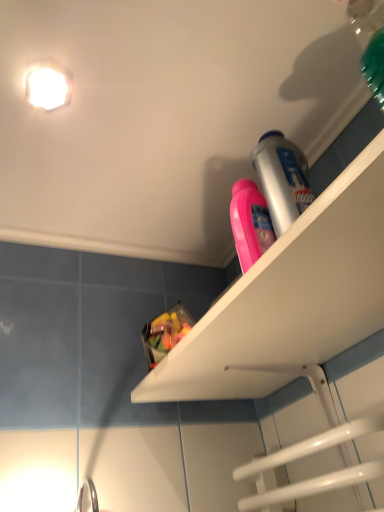
I want to click on vacant region to the right of translucent plastic bag of candy at upper center, so click(x=255, y=358).